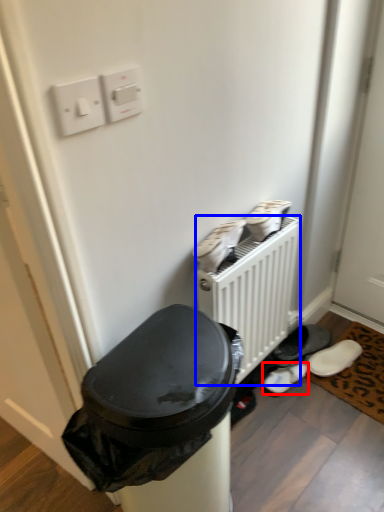
Question: Which object appears farthest to the camera in this image, footwear (highlighted by a red box) or radiator (highlighted by a blue box)?

Choices:
 (A) footwear
 (B) radiator

Answer: (A)